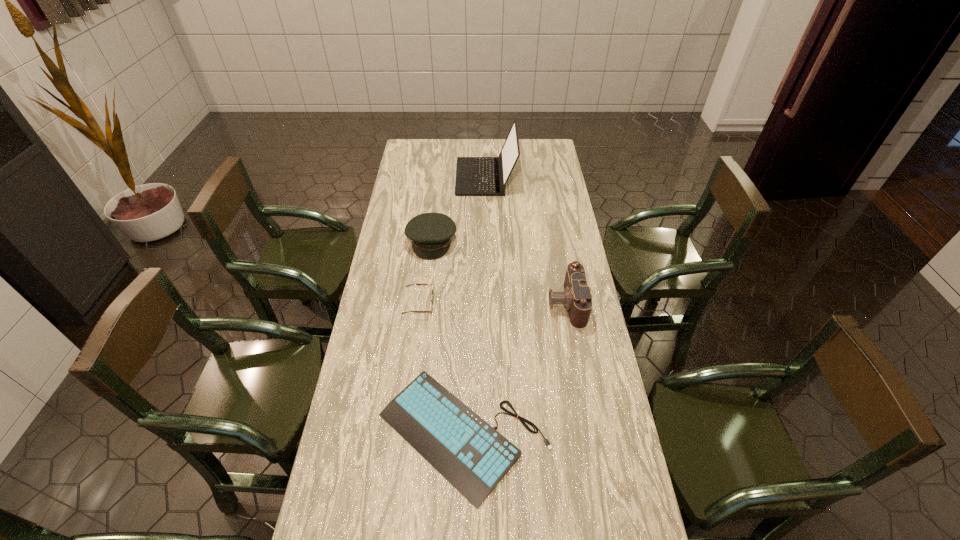
Locate an element on the screen. The image size is (960, 540). blank region between the shortest object and the farthest object is located at coordinates (474, 306).

Identify the location of vacant area between the rightmost object and the spectacles. Image resolution: width=960 pixels, height=540 pixels. (492, 304).

Locate an element on the screen. Image resolution: width=960 pixels, height=540 pixels. empty space between the fourth tallest object and the shortest object is located at coordinates (441, 369).

The image size is (960, 540). I want to click on free space between the laptop and the computer keyboard, so click(474, 306).

Image resolution: width=960 pixels, height=540 pixels. I want to click on empty space between the spectacles and the tallest object, so click(x=452, y=240).

At what (x,y) coordinates should I click in order to perform the action: click on free space between the rightmost object and the farthest object. Please return your answer as a coordinate pair (x, y). The image size is (960, 540). Looking at the image, I should click on (526, 240).

The image size is (960, 540). In order to click on free space between the rightmost object and the shortest object in this screenshot , I will do `click(515, 369)`.

At what (x,y) coordinates should I click in order to perform the action: click on object that is the fourth closest to the fourth tallest object. Please return your answer as a coordinate pair (x, y). The height and width of the screenshot is (540, 960). Looking at the image, I should click on (475, 176).

Choose which object is the second nearest neighbor to the shortest object. Please provide its 2D coordinates. Your answer should be formatted as a tuple, i.e. [(x, y)], where the tuple contains the x and y coordinates of a point satisfying the conditions above.

[(432, 297)]

Where is `free space that satisfies the following two spatial constraints: 1. on the surface of the laptop; 2. on the front-facing side of the second farthest object`? This screenshot has width=960, height=540. free space that satisfies the following two spatial constraints: 1. on the surface of the laptop; 2. on the front-facing side of the second farthest object is located at coordinates (487, 242).